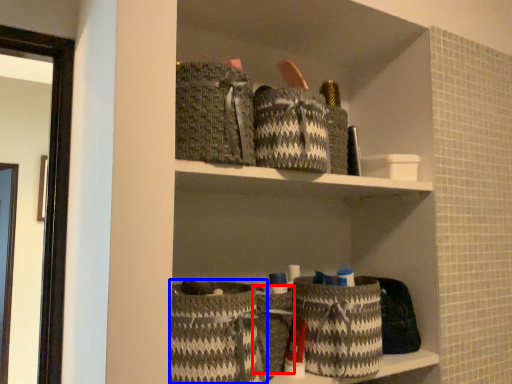
Question: Which object is closer to the camera taking this photo, basket (highlighted by a red box) or basket (highlighted by a blue box)?

Choices:
 (A) basket
 (B) basket

Answer: (B)